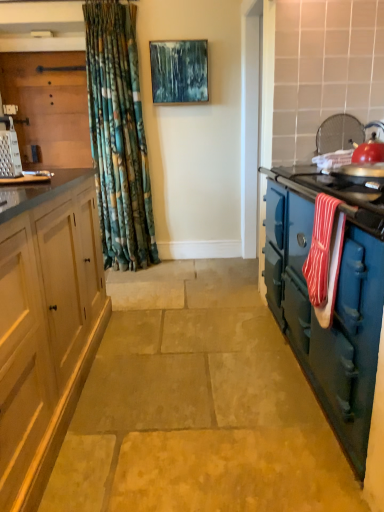
You are a GUI agent. You are given a task and a screenshot of the screen. Output one action in this format:
    pyautogui.click(x=<x>, y=<y>)
    Task: Click on the free region under textured canvas painting at upper center (from a real-world perspective)
    
    Given the screenshot: What is the action you would take?
    pyautogui.click(x=185, y=258)